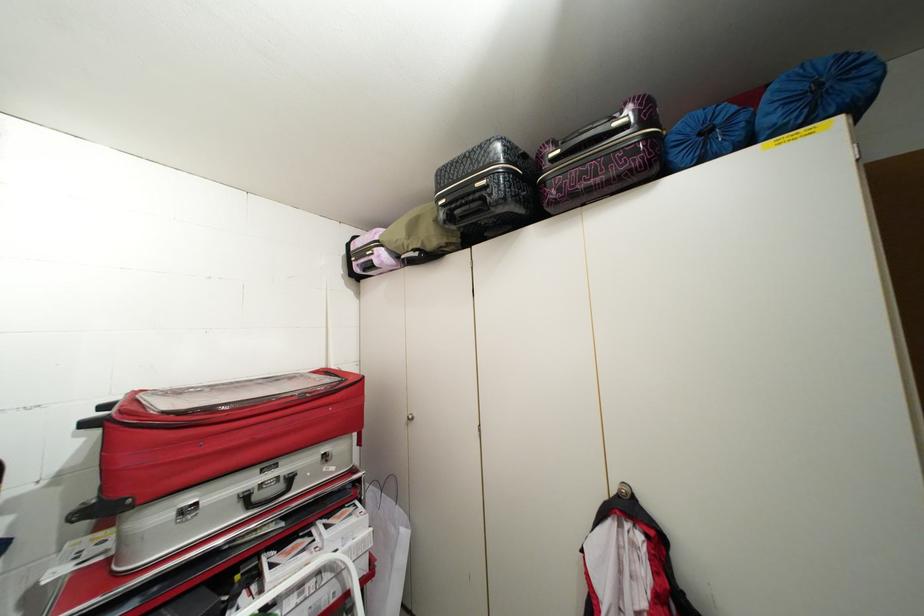
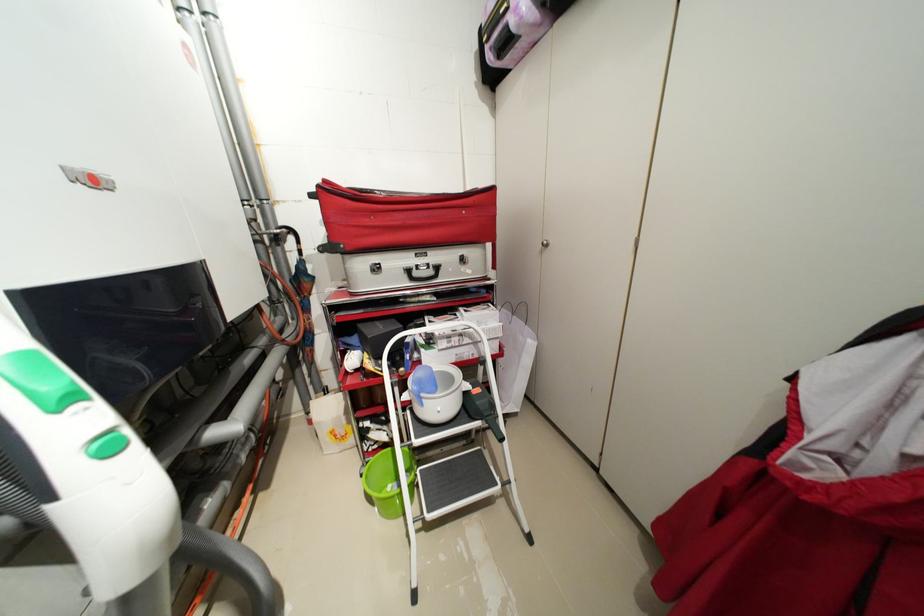
Find the pixel in the second image that matches the point at 373,570 in the first image.

(505, 352)